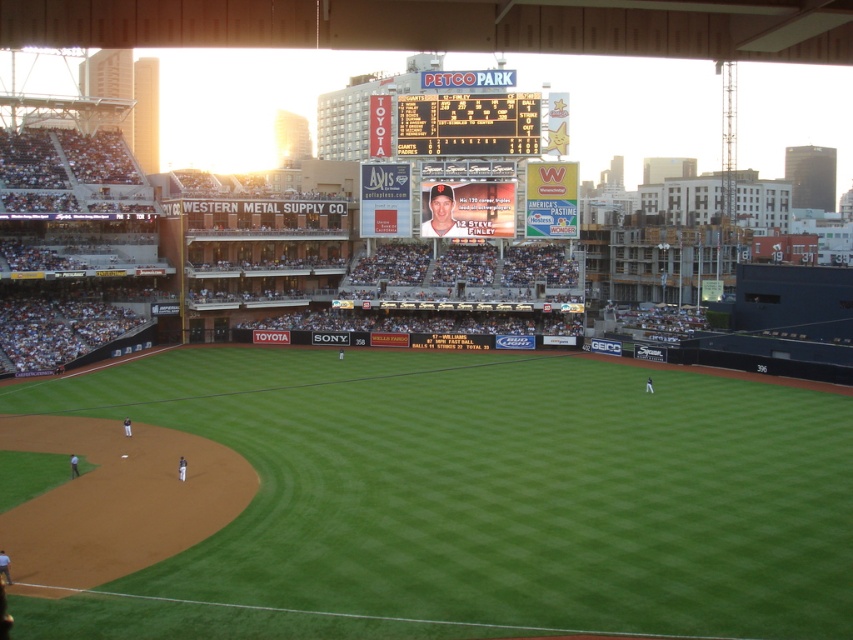
Who is shorter, green artificial turf at center or matte plastic baseball card at center?

matte plastic baseball card at center

Which is in front, point (140, 396) or point (451, 225)?

Point (140, 396) is more forward.

Image resolution: width=853 pixels, height=640 pixels. I want to click on green artificial turf at center, so click(482, 497).

Between black plastic scoreboard at upper center and matte plastic baseball card at center, which one appears on the right side from the viewer's perspective?

From the viewer's perspective, black plastic scoreboard at upper center appears more on the right side.

Can you confirm if black plastic scoreboard at upper center is thinner than matte plastic baseball card at center?

Incorrect, black plastic scoreboard at upper center's width is not less than matte plastic baseball card at center's.

Which is behind, point (538, 145) or point (456, 204)?

The point (456, 204) is behind.

The image size is (853, 640). In order to click on black plastic scoreboard at upper center in this screenshot , I will do `click(468, 124)`.

Is green artificial turf at center below black plastic scoreboard at upper center?

Yes, green artificial turf at center is below black plastic scoreboard at upper center.

Which is behind, point (637, 557) or point (497, 124)?

Positioned behind is point (497, 124).

Where is `green artificial turf at center`? Image resolution: width=853 pixels, height=640 pixels. green artificial turf at center is located at coordinates (482, 497).